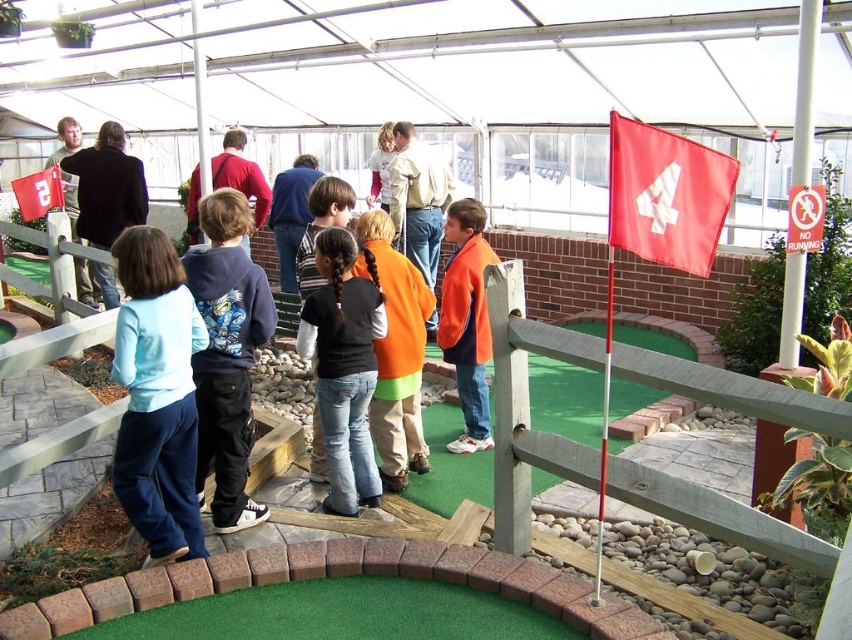
Who is shorter, light blue fleece at center or matte black jacket at upper left?

light blue fleece at center is shorter.

Between point (147, 397) and point (113, 276), which one is positioned behind?

Point (113, 276)

Does point (136, 406) come behind point (104, 272)?

No, (136, 406) is closer to viewer.

This screenshot has height=640, width=852. Find the location of `light blue fleece at center`. light blue fleece at center is located at coordinates (156, 396).

Is black matte vest at center shorter than red fabric flag at upper left?

No.

Identify the location of black matte vest at center. pos(344,365).

This screenshot has height=640, width=852. Find the location of `black matte vest at center`. black matte vest at center is located at coordinates (344, 365).

This screenshot has width=852, height=640. What do you see at coordinates (344, 365) in the screenshot? I see `black matte vest at center` at bounding box center [344, 365].

Does point (357, 252) come in front of point (82, 160)?

That is True.

Find the location of a particular element. This screenshot has width=852, height=640. black matte vest at center is located at coordinates [x=344, y=365].